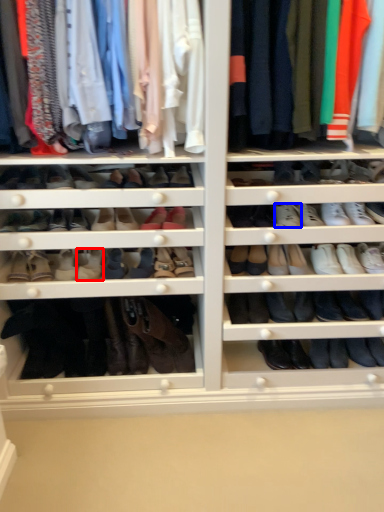
Question: Which point is further to the camera, shoe (highlighted by a red box) or shoe (highlighted by a blue box)?

Choices:
 (A) shoe
 (B) shoe

Answer: (A)